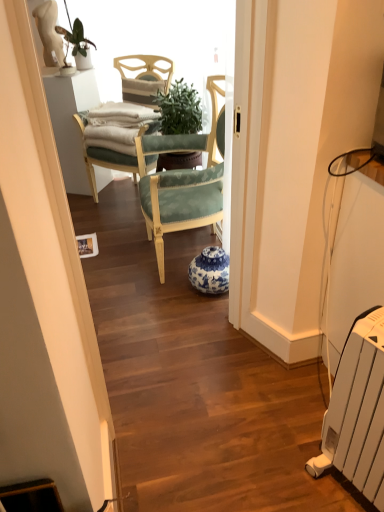
Question: Would you say green leafy plant at upper left is inside or outside white plastic radiator at lower right?

Choices:
 (A) inside
 (B) outside

Answer: (B)

Question: Considering the positions of green leafy plant at upper left and white plastic radiator at lower right in the image, is green leafy plant at upper left wider or thinner than white plastic radiator at lower right?

Choices:
 (A) thin
 (B) wide

Answer: (A)

Question: Estimate the real-world distances between objects in this image. Which object is farther from the white plastic radiator at lower right?

Choices:
 (A) green leafy plant at upper left
 (B) blue and white porcelain vase at center

Answer: (A)

Question: Which of these objects is positioned farthest from the green leafy plant at upper left?

Choices:
 (A) blue and white porcelain vase at center
 (B) white plastic radiator at lower right

Answer: (B)